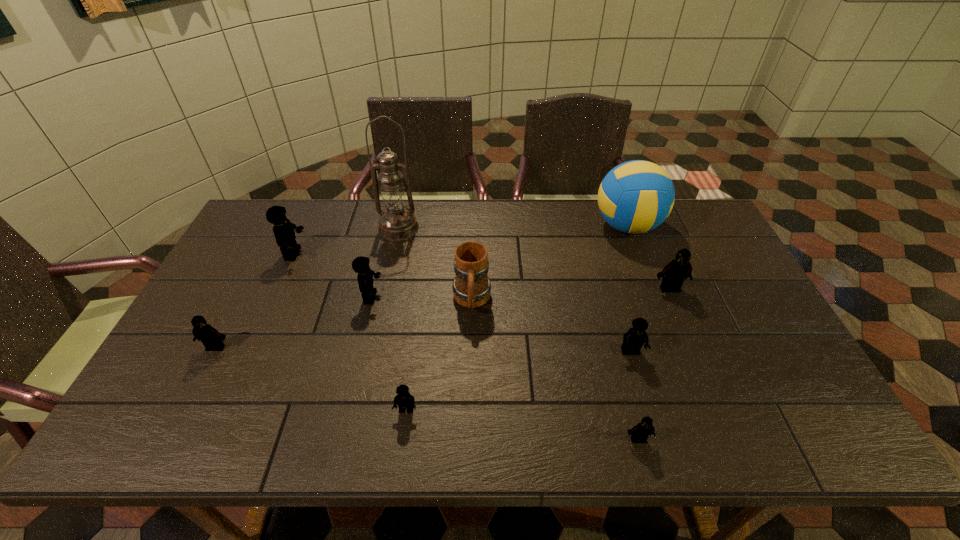
The height and width of the screenshot is (540, 960). Find the location of `black Lego that stands as the second closest to the smallest black Lego`. black Lego that stands as the second closest to the smallest black Lego is located at coordinates (211, 338).

Locate an element on the screen. free space that satisfies the following two spatial constraints: 1. on the back side of the second tallest object; 2. on the left side of the tallest object is located at coordinates (399, 226).

Identify the location of free space that satisfies the following two spatial constraints: 1. on the front-facing side of the third smallest yellow Lego; 2. on the face of the leftmost Lego. point(360,347).